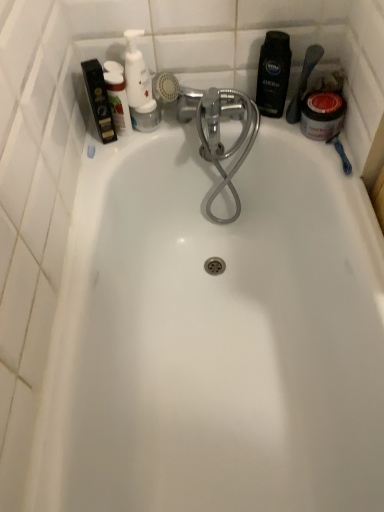
What is the approximate width of white glossy pump bottle at upper left, which is counted as the second toiletry, starting from the left?

2.27 inches.

Identify the location of matte black jar at upper right. This screenshot has width=384, height=512. (303, 82).

Find the location of a particular element. white glossy pump bottle at upper left, which is counted as the 2th toiletry, starting from the right is located at coordinates (139, 86).

Image resolution: width=384 pixels, height=512 pixels. Find the location of `the 2nd toiletry behind the matte black jar at upper right, counting from the anchor's position`. the 2nd toiletry behind the matte black jar at upper right, counting from the anchor's position is located at coordinates (273, 74).

Is point (297, 116) closer to viewer compared to point (281, 74)?

No, (297, 116) is behind (281, 74).

Can you confirm if white glossy pump bottle at upper left, acting as the 1th toiletry starting from the left, is wider than white glossy pump bottle at upper left, which is counted as the second toiletry, starting from the left?

Incorrect, the width of white glossy pump bottle at upper left, acting as the 1th toiletry starting from the left, does not surpass that of white glossy pump bottle at upper left, which is counted as the second toiletry, starting from the left.

From the image's perspective, is white glossy pump bottle at upper left, the 3th toiletry viewed from the right, below white glossy pump bottle at upper left, which is counted as the 2th toiletry, starting from the right?

Yes, from the image's perspective, white glossy pump bottle at upper left, the 3th toiletry viewed from the right, is below white glossy pump bottle at upper left, which is counted as the 2th toiletry, starting from the right.

Is white glossy pump bottle at upper left, acting as the 1th toiletry starting from the left, oriented away from white glossy pump bottle at upper left, which is counted as the second toiletry, starting from the left?

That's not correct — white glossy pump bottle at upper left, acting as the 1th toiletry starting from the left, is not looking away from white glossy pump bottle at upper left, which is counted as the second toiletry, starting from the left.

Does white glossy pump bottle at upper left, which is counted as the second toiletry, starting from the left, contain matte black jar at upper right?

Actually, matte black jar at upper right is outside white glossy pump bottle at upper left, which is counted as the second toiletry, starting from the left.

The height and width of the screenshot is (512, 384). Identify the location of toiletry that is the 2nd one when counting leftward from the matte black jar at upper right. (139, 86).

Looking at this image, considering the sizes of objects white glossy pump bottle at upper left, which is counted as the second toiletry, starting from the left, and matte black jar at upper right in the image provided, who is thinner, white glossy pump bottle at upper left, which is counted as the second toiletry, starting from the left, or matte black jar at upper right?

matte black jar at upper right.

Considering the relative sizes of white glossy pump bottle at upper left, which is counted as the second toiletry, starting from the left, and matte black jar at upper right in the image provided, is white glossy pump bottle at upper left, which is counted as the second toiletry, starting from the left, smaller than matte black jar at upper right?

Incorrect, white glossy pump bottle at upper left, which is counted as the second toiletry, starting from the left, is not smaller in size than matte black jar at upper right.

Considering the positions of points (127, 77) and (264, 114), is point (127, 77) farther from camera compared to point (264, 114)?

No, it is not.

In the scene shown: How many degrees apart are the facing directions of white glossy pump bottle at upper left, which is counted as the 2th toiletry, starting from the right, and deep black shampoo at upper right, acting as the first toiletry starting from the right?

24.3 degrees separate the facing orientations of white glossy pump bottle at upper left, which is counted as the 2th toiletry, starting from the right, and deep black shampoo at upper right, acting as the first toiletry starting from the right.

Is white glossy pump bottle at upper left, which is counted as the second toiletry, starting from the left, wider than deep black shampoo at upper right, marked as the 3th toiletry in a left-to-right arrangement?

Yes.

Between point (114, 84) and point (272, 36), which one is positioned in front?

The point (272, 36) is more forward.

Can you confirm if white glossy pump bottle at upper left, the 3th toiletry viewed from the right, is wider than deep black shampoo at upper right, marked as the 3th toiletry in a left-to-right arrangement?

Yes, white glossy pump bottle at upper left, the 3th toiletry viewed from the right, is wider than deep black shampoo at upper right, marked as the 3th toiletry in a left-to-right arrangement.

From the image's perspective, which is below, white glossy pump bottle at upper left, the 3th toiletry viewed from the right, or deep black shampoo at upper right, acting as the first toiletry starting from the right?

white glossy pump bottle at upper left, the 3th toiletry viewed from the right, from the image's perspective.

From a real-world perspective, is white glossy pump bottle at upper left, the 3th toiletry viewed from the right, above or below matte black jar at upper right?

In terms of real-world spatial position, white glossy pump bottle at upper left, the 3th toiletry viewed from the right, is above matte black jar at upper right.

Which is correct: white glossy pump bottle at upper left, the 3th toiletry viewed from the right, is inside matte black jar at upper right, or outside of it?

white glossy pump bottle at upper left, the 3th toiletry viewed from the right, cannot be found inside matte black jar at upper right.

Between white glossy pump bottle at upper left, the 3th toiletry viewed from the right, and matte black jar at upper right, which one has more height?

white glossy pump bottle at upper left, the 3th toiletry viewed from the right.

Looking at their sizes, would you say white glossy pump bottle at upper left, acting as the 1th toiletry starting from the left, is wider or thinner than matte black jar at upper right?

Clearly, white glossy pump bottle at upper left, acting as the 1th toiletry starting from the left, has less width compared to matte black jar at upper right.

In terms of height, does white glossy pump bottle at upper left, which is counted as the 2th toiletry, starting from the right, look taller or shorter compared to white glossy pump bottle at upper left, acting as the 1th toiletry starting from the left?

Clearly, white glossy pump bottle at upper left, which is counted as the 2th toiletry, starting from the right, is taller compared to white glossy pump bottle at upper left, acting as the 1th toiletry starting from the left.

Considering the relative positions of white glossy pump bottle at upper left, which is counted as the second toiletry, starting from the left, and white glossy pump bottle at upper left, acting as the 1th toiletry starting from the left, in the image provided, is white glossy pump bottle at upper left, which is counted as the second toiletry, starting from the left, in front of white glossy pump bottle at upper left, acting as the 1th toiletry starting from the left,?

No.

Considering the relative sizes of white glossy pump bottle at upper left, which is counted as the 2th toiletry, starting from the right, and white glossy pump bottle at upper left, acting as the 1th toiletry starting from the left, in the image provided, is white glossy pump bottle at upper left, which is counted as the 2th toiletry, starting from the right, thinner than white glossy pump bottle at upper left, acting as the 1th toiletry starting from the left,?

No, white glossy pump bottle at upper left, which is counted as the 2th toiletry, starting from the right, is not thinner than white glossy pump bottle at upper left, acting as the 1th toiletry starting from the left.

Between white glossy pump bottle at upper left, which is counted as the second toiletry, starting from the left, and white glossy pump bottle at upper left, the 3th toiletry viewed from the right, which one appears on the left side from the viewer's perspective?

white glossy pump bottle at upper left, the 3th toiletry viewed from the right, is more to the left.

The image size is (384, 512). What are the coordinates of `shower on the right of deep black shampoo at upper right, marked as the 3th toiletry in a left-to-right arrangement` in the screenshot? It's located at (303, 82).

From the white glossy pump bottle at upper left, the 3th toiletry viewed from the right, count 1st toiletrys backward and point to it. Please provide its 2D coordinates.

[(139, 86)]

Which object lies further to the anchor point white glossy pump bottle at upper left, which is counted as the second toiletry, starting from the left, white glossy pump bottle at upper left, acting as the 1th toiletry starting from the left, or matte black jar at upper right?

matte black jar at upper right is positioned further to the anchor white glossy pump bottle at upper left, which is counted as the second toiletry, starting from the left.

From the image, which object appears to be nearer to matte black jar at upper right, deep black shampoo at upper right, marked as the 3th toiletry in a left-to-right arrangement, or white glossy pump bottle at upper left, the 3th toiletry viewed from the right?

Based on the image, deep black shampoo at upper right, marked as the 3th toiletry in a left-to-right arrangement, appears to be nearer to matte black jar at upper right.

When comparing their distances from deep black shampoo at upper right, acting as the first toiletry starting from the right, does matte black jar at upper right or white glossy pump bottle at upper left, which is counted as the 2th toiletry, starting from the right, seem closer?

Based on the image, matte black jar at upper right appears to be nearer to deep black shampoo at upper right, acting as the first toiletry starting from the right.

From the image, which object appears to be farther from white glossy pump bottle at upper left, the 3th toiletry viewed from the right, matte black jar at upper right or white glossy pump bottle at upper left, which is counted as the second toiletry, starting from the left?

matte black jar at upper right.

Which object lies nearer to the anchor point white glossy pump bottle at upper left, which is counted as the 2th toiletry, starting from the right, deep black shampoo at upper right, acting as the first toiletry starting from the right, or white glossy pump bottle at upper left, the 3th toiletry viewed from the right?

Based on the image, white glossy pump bottle at upper left, the 3th toiletry viewed from the right, appears to be nearer to white glossy pump bottle at upper left, which is counted as the 2th toiletry, starting from the right.

Looking at the image, which one is located closer to white glossy pump bottle at upper left, which is counted as the 2th toiletry, starting from the right, deep black shampoo at upper right, acting as the first toiletry starting from the right, or matte black jar at upper right?

deep black shampoo at upper right, acting as the first toiletry starting from the right.

From the image, which object appears to be farther from white glossy pump bottle at upper left, acting as the 1th toiletry starting from the left, matte black jar at upper right or deep black shampoo at upper right, marked as the 3th toiletry in a left-to-right arrangement?

matte black jar at upper right is further to white glossy pump bottle at upper left, acting as the 1th toiletry starting from the left.

Based on their spatial positions, is deep black shampoo at upper right, marked as the 3th toiletry in a left-to-right arrangement, or white glossy pump bottle at upper left, which is counted as the 2th toiletry, starting from the right, further from white glossy pump bottle at upper left, the 3th toiletry viewed from the right?

deep black shampoo at upper right, marked as the 3th toiletry in a left-to-right arrangement, is further to white glossy pump bottle at upper left, the 3th toiletry viewed from the right.

At what (x,y) coordinates should I click in order to perform the action: click on toiletry between white glossy pump bottle at upper left, acting as the 1th toiletry starting from the left, and deep black shampoo at upper right, acting as the first toiletry starting from the right, from left to right. Please return your answer as a coordinate pair (x, y). The image size is (384, 512). Looking at the image, I should click on (139, 86).

Where is `toiletry between white glossy pump bottle at upper left, which is counted as the 2th toiletry, starting from the right, and matte black jar at upper right from left to right`? toiletry between white glossy pump bottle at upper left, which is counted as the 2th toiletry, starting from the right, and matte black jar at upper right from left to right is located at coordinates (273, 74).